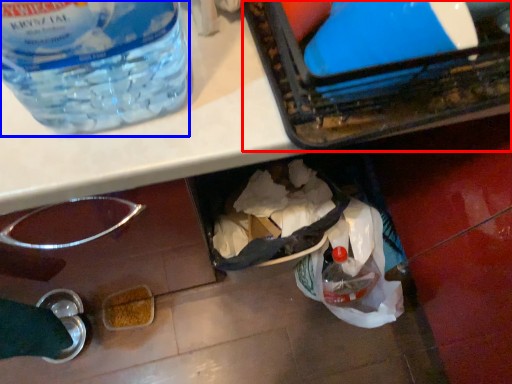
Question: Which point is closer to the camera, box (highlighted by a red box) or bottle (highlighted by a blue box)?

Choices:
 (A) box
 (B) bottle

Answer: (B)